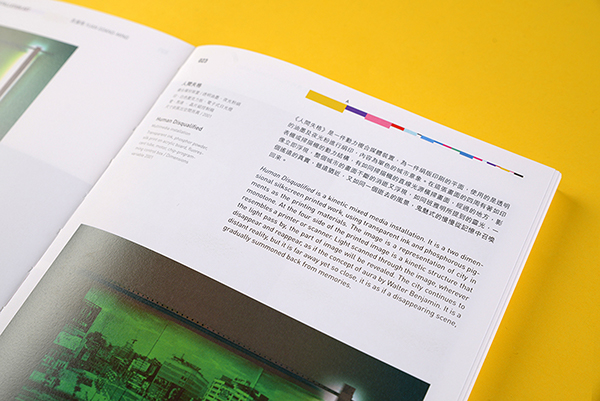
Find the location of a particular element. magazine is located at coordinates (116, 194).